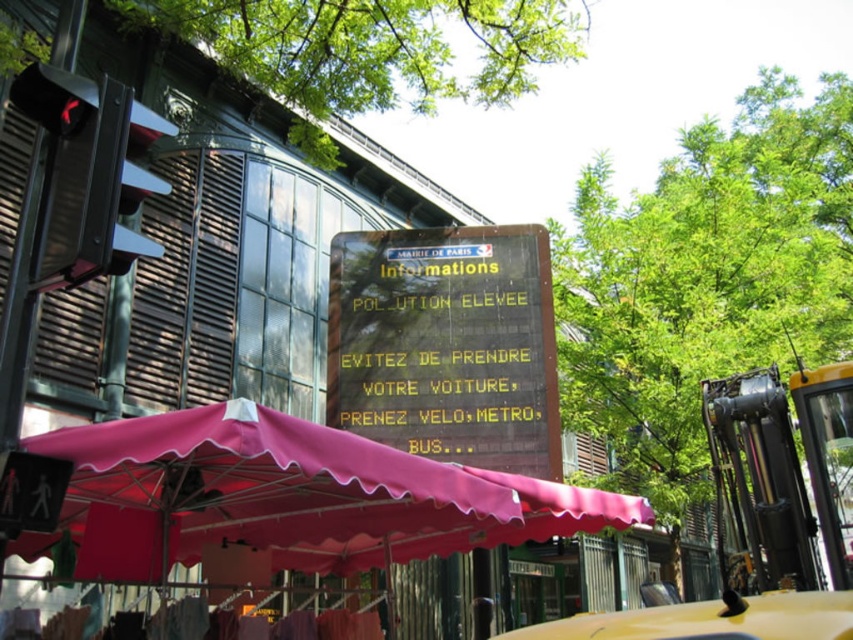
Question: Can you confirm if wooden signboard at center is wider than yellow rubber taxi at lower right?

Choices:
 (A) no
 (B) yes

Answer: (B)

Question: Can you confirm if wooden signboard at center is thinner than yellow rubber taxi at lower right?

Choices:
 (A) yes
 (B) no

Answer: (B)

Question: Which point appears closest to the camera in this image?

Choices:
 (A) (724, 628)
 (B) (492, 282)

Answer: (A)

Question: Is wooden signboard at center positioned at the back of yellow rubber taxi at lower right?

Choices:
 (A) no
 (B) yes

Answer: (B)